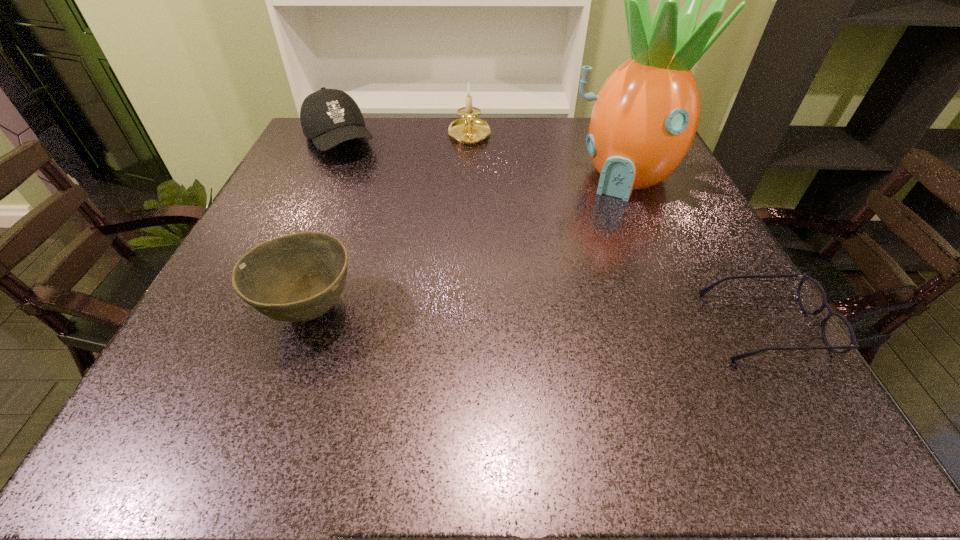
The image size is (960, 540). I want to click on bowl at the left edge, so click(x=297, y=277).

Find the location of a particular element. This screenshot has height=540, width=960. baseball cap present at the left edge is located at coordinates (329, 117).

The width and height of the screenshot is (960, 540). I want to click on spectacles positioned at the right edge, so click(x=838, y=334).

Identify the location of pineapple at the right edge. This screenshot has height=540, width=960. (645, 117).

Find the location of a particular element. object at the far left corner is located at coordinates (329, 117).

Locate an element on the screen. This screenshot has height=540, width=960. object present at the near left corner is located at coordinates (297, 277).

Where is `object present at the far right corner`? This screenshot has height=540, width=960. object present at the far right corner is located at coordinates pos(645,117).

Image resolution: width=960 pixels, height=540 pixels. Find the location of `object that is at the near right corner`. object that is at the near right corner is located at coordinates (838, 334).

The image size is (960, 540). In order to click on vacant space at the far edge of the desktop in this screenshot , I will do `click(584, 145)`.

In the image, there is a desktop. Identify the location of vacant area at the near edge. This screenshot has height=540, width=960. (323, 373).